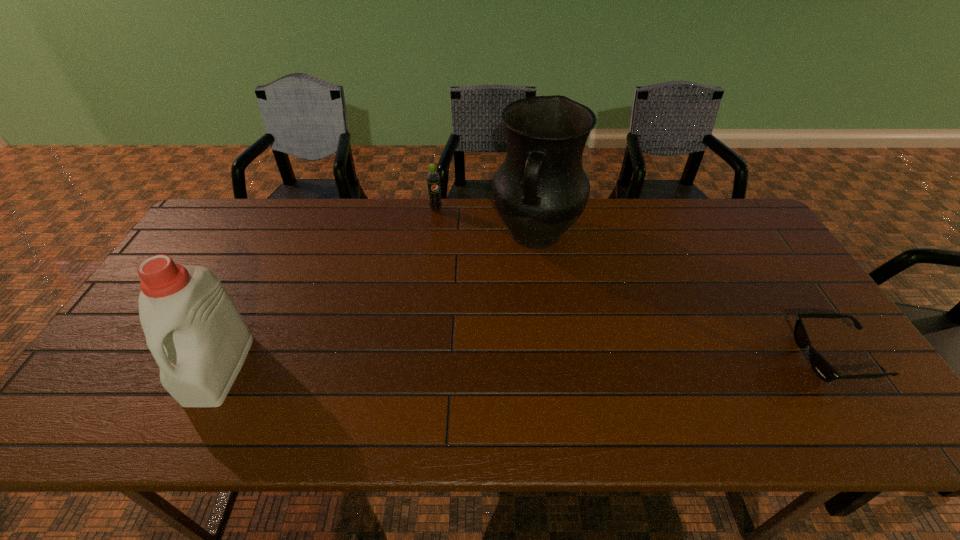
Where is `detergent`? This screenshot has width=960, height=540. detergent is located at coordinates (198, 338).

Locate an element on the screen. The width and height of the screenshot is (960, 540). the third shortest object is located at coordinates (198, 338).

This screenshot has height=540, width=960. Identify the location of the shortest object. (818, 363).

The height and width of the screenshot is (540, 960). I want to click on the rightmost object, so click(818, 363).

This screenshot has width=960, height=540. I want to click on the tallest object, so click(540, 190).

Locate an element on the screen. The width and height of the screenshot is (960, 540). the third object from left to right is located at coordinates (540, 190).

The image size is (960, 540). I want to click on the second object from left to right, so click(433, 178).

Locate an element on the screen. The image size is (960, 540). soda is located at coordinates (433, 178).

The width and height of the screenshot is (960, 540). In order to click on free space located 0.340m on the front-facing side of the sunglasses in this screenshot , I will do `click(660, 357)`.

In order to click on vacant area situated 0.060m on the front-facing side of the sunglasses in this screenshot , I will do `click(775, 357)`.